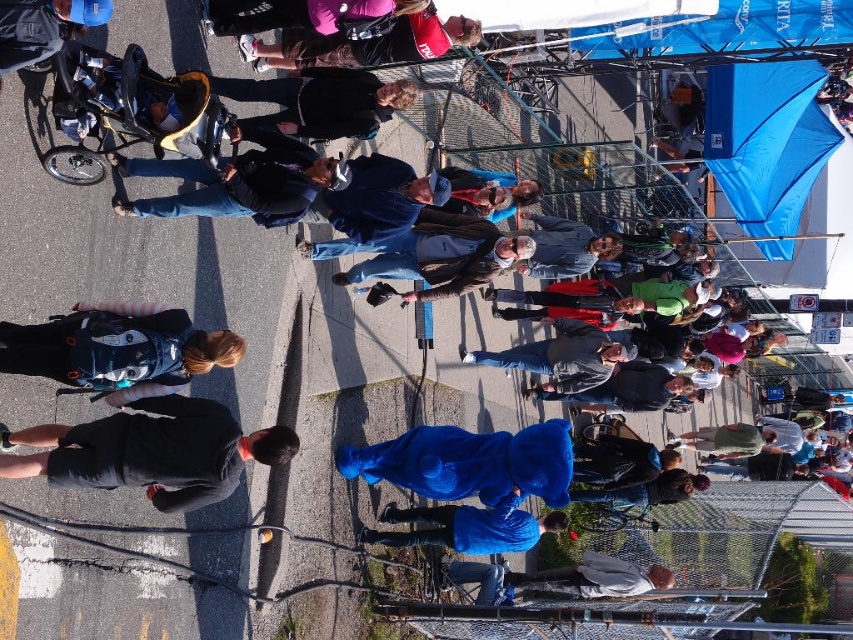
You are a photographer trying to capture a photo of the blue plush bear at center and the matte pink jacket at upper center. Can you frame both objects in the same shot without moving your camera position?

Yes, because the blue plush bear at center is below the matte pink jacket at upper center, both can be captured in the same frame without moving the camera.

You are a photographer trying to capture a clear shot of the blue fleece jacket at lower center without the matte blue backpack at left blocking it. What adjustment should you make to your camera angle?

The matte blue backpack at left is above the blue fleece jacket at lower center, so you can lower your camera angle to position it below the backpack and still capture the jacket.

You are a photographer standing at the center of the scene. You want to take a photo of the blue plush bear at center. Where should you aim your camera to capture it in the frame?

You should aim your camera at the coordinates point (469, 461) to capture the blue plush bear at center in the frame.